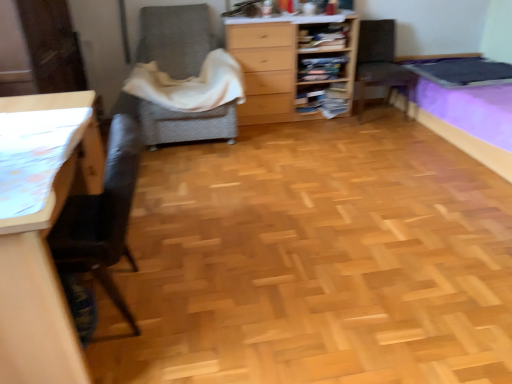
Question: Is the depth of wooden bookshelf at center, the third shelf from the top, less than that of brown fabric chair at upper right, the 2th chair viewed from the left?

Choices:
 (A) yes
 (B) no

Answer: (B)

Question: Can you confirm if wooden bookshelf at center, the third shelf from the top, is bigger than brown fabric chair at upper right, the 2th chair viewed from the left?

Choices:
 (A) no
 (B) yes

Answer: (A)

Question: Is wooden bookshelf at center, the third shelf from the top, surrounding brown fabric chair at upper right, the 2th chair viewed from the left?

Choices:
 (A) yes
 (B) no

Answer: (B)

Question: Does wooden bookshelf at center, the third shelf from the top, turn towards brown fabric chair at upper right, acting as the first chair starting from the right?

Choices:
 (A) yes
 (B) no

Answer: (B)

Question: Are wooden bookshelf at center, the third shelf from the top, and brown fabric chair at upper right, the 2th chair viewed from the left, located far from each other?

Choices:
 (A) no
 (B) yes

Answer: (A)

Question: Considering the positions of point (36, 291) and point (258, 91), is point (36, 291) closer or farther from the camera than point (258, 91)?

Choices:
 (A) farther
 (B) closer

Answer: (B)

Question: In terms of height, does light brown wood desk at left look taller or shorter compared to wooden chest of drawers at center?

Choices:
 (A) short
 (B) tall

Answer: (A)

Question: Visually, is light brown wood desk at left positioned to the left or to the right of wooden chest of drawers at center?

Choices:
 (A) right
 (B) left

Answer: (B)

Question: In the image, is light brown wood desk at left positioned in front of or behind wooden chest of drawers at center?

Choices:
 (A) front
 (B) behind

Answer: (A)

Question: From a real-world perspective, relative to purple fabric bed at right, is white soft blanket at center vertically above or below?

Choices:
 (A) above
 (B) below

Answer: (A)

Question: Considering their positions, is white soft blanket at center located in front of or behind purple fabric bed at right?

Choices:
 (A) behind
 (B) front

Answer: (A)

Question: Considering the positions of white soft blanket at center and purple fabric bed at right in the image, is white soft blanket at center taller or shorter than purple fabric bed at right?

Choices:
 (A) short
 (B) tall

Answer: (A)

Question: From the image's perspective, is white soft blanket at center above or below purple fabric bed at right?

Choices:
 (A) above
 (B) below

Answer: (A)

Question: Is textured gray armchair at center, which is the second chair in right-to-left order, to the left or to the right of white soft blanket at center in the image?

Choices:
 (A) left
 (B) right

Answer: (A)

Question: In terms of height, does textured gray armchair at center, placed as the first chair when sorted from left to right, look taller or shorter compared to white soft blanket at center?

Choices:
 (A) short
 (B) tall

Answer: (B)